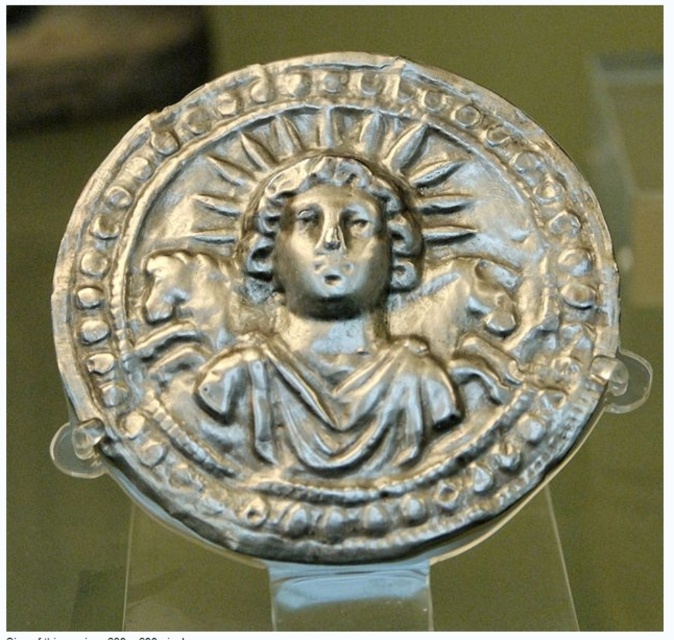
Question: Among these points, which one is nearest to the camera?

Choices:
 (A) (334, 282)
 (B) (297, 435)
 (C) (319, 554)

Answer: (C)

Question: Is shiny silver coin at center wider than shiny silver deity at center?

Choices:
 (A) no
 (B) yes

Answer: (B)

Question: Is shiny silver deity at center behind shiny silver head at center?

Choices:
 (A) no
 (B) yes

Answer: (A)

Question: Can you confirm if shiny silver coin at center is wider than shiny silver deity at center?

Choices:
 (A) no
 (B) yes

Answer: (B)

Question: Among these objects, which one is farthest from the camera?

Choices:
 (A) shiny silver deity at center
 (B) shiny silver coin at center
 (C) shiny silver head at center

Answer: (C)

Question: Which point is closer to the camera?

Choices:
 (A) (102, 275)
 (B) (377, 451)

Answer: (B)